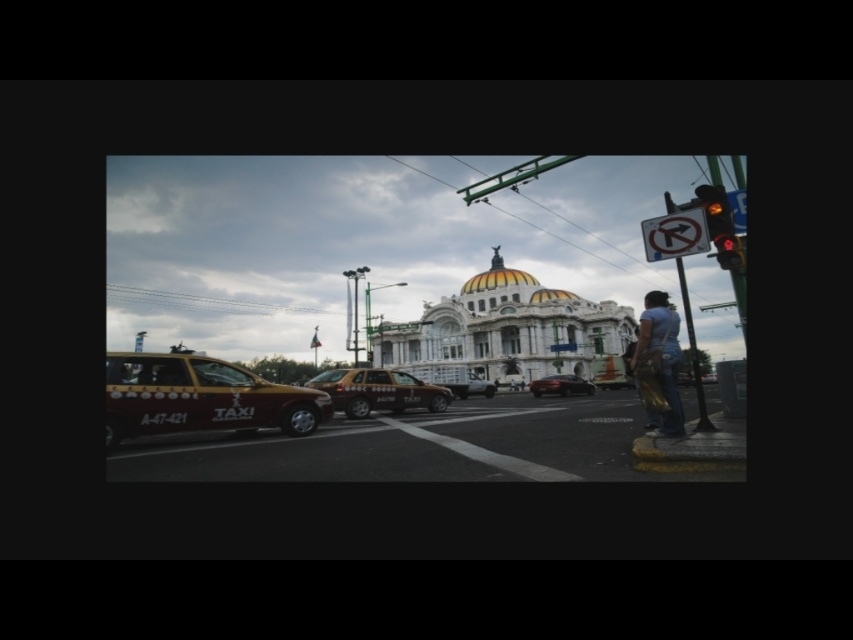
You are a delivery person who needs to load a large package onto a vehicle. You see the yellow glossy taxi at left and the shiny black sedan at center. Which vehicle should you choose to ensure the package can fit inside?

The yellow glossy taxi at left is much taller than the shiny black sedan at center, so you should choose the yellow glossy taxi at left to ensure the package can fit inside.

You are a city planner analyzing traffic flow in this area. You need to determine if a new parking space for the shiny black sedan at center can be placed between the yellow glossy taxi at left and another vehicle. Considering their widths, will there be enough space?

The yellow glossy taxi at left is wider than the shiny black sedan at center. Therefore, if the space between the yellow glossy taxi at left and the other vehicle accommodates the sedan, it should suffice since the sedan is narrower.